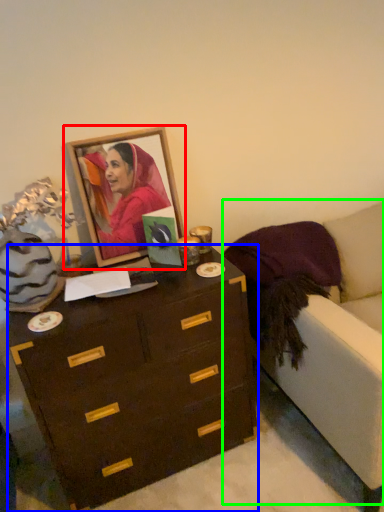
Question: Considering the real-world distances, which object is closest to picture frame (highlighted by a red box)? chest of drawers (highlighted by a blue box) or armchair (highlighted by a green box).

Choices:
 (A) chest of drawers
 (B) armchair

Answer: (A)